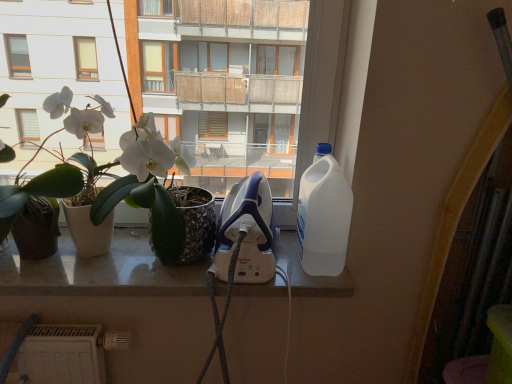
Question: Can you confirm if white glossy iron at center is thinner than green matte plant at left, placed as the second houseplant when sorted from right to left?

Choices:
 (A) no
 (B) yes

Answer: (A)

Question: Is white glossy iron at center wider than green matte plant at left, the 1th houseplant in the left-to-right sequence?

Choices:
 (A) no
 (B) yes

Answer: (B)

Question: Does white glossy iron at center lie in front of green matte plant at left, placed as the second houseplant when sorted from right to left?

Choices:
 (A) no
 (B) yes

Answer: (A)

Question: Does white glossy iron at center come behind green matte plant at left, placed as the second houseplant when sorted from right to left?

Choices:
 (A) yes
 (B) no

Answer: (A)

Question: From a real-world perspective, is white glossy iron at center over green matte plant at left, the 1th houseplant in the left-to-right sequence?

Choices:
 (A) no
 (B) yes

Answer: (A)

Question: Considering the relative sizes of white glossy iron at center and green matte plant at left, the 1th houseplant in the left-to-right sequence, in the image provided, is white glossy iron at center taller than green matte plant at left, the 1th houseplant in the left-to-right sequence,?

Choices:
 (A) yes
 (B) no

Answer: (B)

Question: Does green matte plant at left, the 1th houseplant in the left-to-right sequence, contain white plastic bottle at right?

Choices:
 (A) no
 (B) yes

Answer: (A)

Question: From the image's perspective, is green matte plant at left, the 1th houseplant in the left-to-right sequence, under white plastic bottle at right?

Choices:
 (A) no
 (B) yes

Answer: (B)

Question: Considering the relative positions of green matte plant at left, the 1th houseplant in the left-to-right sequence, and white plastic bottle at right in the image provided, is green matte plant at left, the 1th houseplant in the left-to-right sequence, to the right of white plastic bottle at right from the viewer's perspective?

Choices:
 (A) no
 (B) yes

Answer: (A)

Question: From a real-world perspective, does green matte plant at left, placed as the second houseplant when sorted from right to left, sit lower than white plastic bottle at right?

Choices:
 (A) no
 (B) yes

Answer: (B)

Question: Is green matte plant at left, the 1th houseplant in the left-to-right sequence, looking in the opposite direction of white plastic bottle at right?

Choices:
 (A) no
 (B) yes

Answer: (A)

Question: Is green matte plant at left, placed as the second houseplant when sorted from right to left, at the left side of white plastic bottle at right?

Choices:
 (A) no
 (B) yes

Answer: (B)

Question: From a real-world perspective, is white matte plant pot at left, acting as the second houseplant starting from the left, positioned over white plastic bottle at right based on gravity?

Choices:
 (A) no
 (B) yes

Answer: (B)